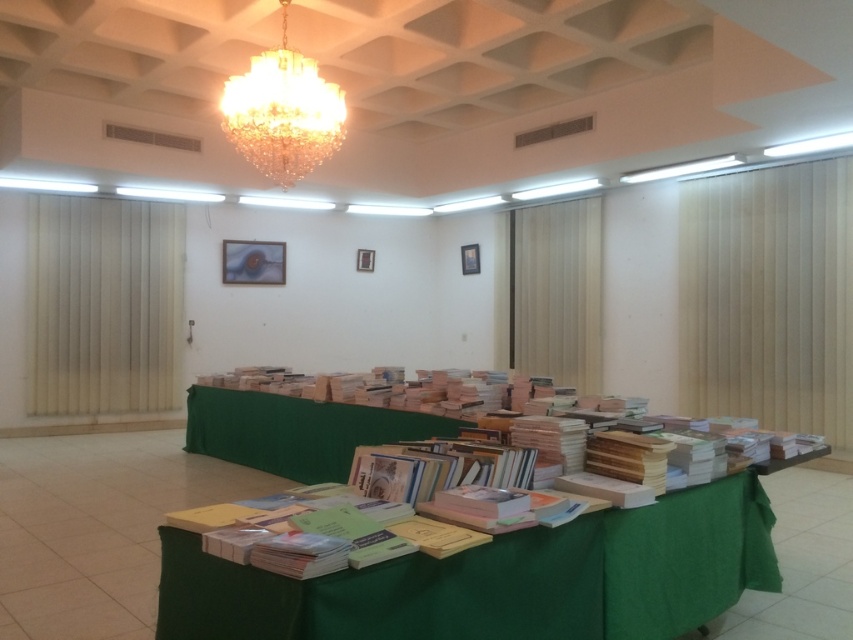
You are a delivery person who needs to place a package between the wooden curtain at center and the crystal at upper center. The package requires 4 meters of space. Can you fit it between them?

The distance between the wooden curtain at center and the crystal at upper center is 3.88 meters, which is less than the required 4 meters. Therefore, the package cannot be placed between them.